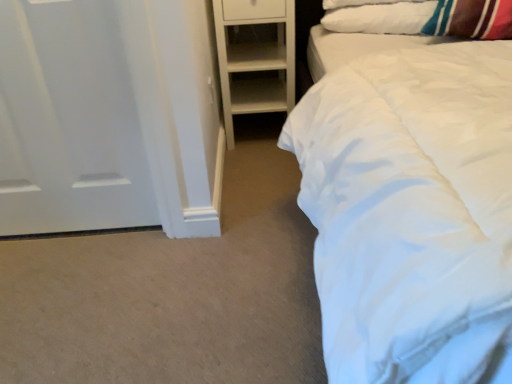
Question: Considering the relative sizes of white soft pillow at upper right and white matte door at left in the image provided, is white soft pillow at upper right thinner than white matte door at left?

Choices:
 (A) no
 (B) yes

Answer: (A)

Question: Is white soft pillow at upper right further to camera compared to white matte door at left?

Choices:
 (A) no
 (B) yes

Answer: (B)

Question: From a real-world perspective, is white soft pillow at upper right positioned under white matte door at left based on gravity?

Choices:
 (A) yes
 (B) no

Answer: (B)

Question: Is white soft pillow at upper right closer to the viewer compared to white matte door at left?

Choices:
 (A) no
 (B) yes

Answer: (A)

Question: Considering the relative sizes of white soft pillow at upper right and white matte door at left in the image provided, is white soft pillow at upper right taller than white matte door at left?

Choices:
 (A) no
 (B) yes

Answer: (A)

Question: Based on their sizes in the image, would you say white matte wooden shelf at center is bigger or smaller than white soft pillow at upper right?

Choices:
 (A) big
 (B) small

Answer: (A)

Question: Visually, is white matte wooden shelf at center positioned to the left or to the right of white soft pillow at upper right?

Choices:
 (A) right
 (B) left

Answer: (B)

Question: Is white matte wooden shelf at center situated inside white soft pillow at upper right or outside?

Choices:
 (A) inside
 (B) outside

Answer: (B)

Question: Is white matte wooden shelf at center in front of or behind white soft pillow at upper right in the image?

Choices:
 (A) front
 (B) behind

Answer: (B)

Question: Is white matte door at left in front of or behind white matte wooden shelf at center in the image?

Choices:
 (A) front
 (B) behind

Answer: (A)

Question: From the image's perspective, is white matte door at left positioned above or below white matte wooden shelf at center?

Choices:
 (A) above
 (B) below

Answer: (B)

Question: Is white matte door at left inside or outside of white matte wooden shelf at center?

Choices:
 (A) inside
 (B) outside

Answer: (B)

Question: Is white matte door at left bigger or smaller than white matte wooden shelf at center?

Choices:
 (A) small
 (B) big

Answer: (A)

Question: Considering the relative positions of white matte door at left and white soft pillow at upper right in the image provided, is white matte door at left to the left or to the right of white soft pillow at upper right?

Choices:
 (A) right
 (B) left

Answer: (B)

Question: Is white matte door at left wider or thinner than white soft pillow at upper right?

Choices:
 (A) wide
 (B) thin

Answer: (B)